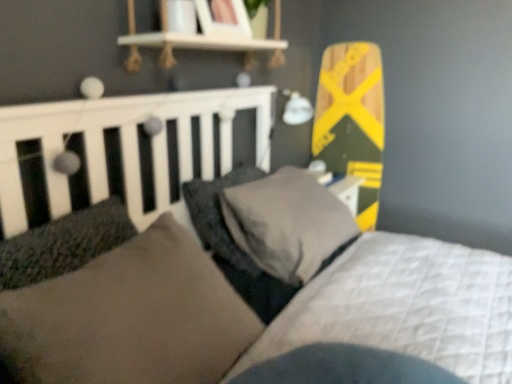
Question: Considering their positions, is suede-like brown pillow at center, which is the first pillow in front-to-back order, located in front of or behind dark gray textured pillow at center, placed as the 3th pillow when sorted from front to back?

Choices:
 (A) front
 (B) behind

Answer: (A)

Question: Visually, is suede-like brown pillow at center, the third pillow from the back, positioned to the left or to the right of dark gray textured pillow at center, placed as the 3th pillow when sorted from front to back?

Choices:
 (A) left
 (B) right

Answer: (A)

Question: Considering the real-world distances, which object is farthest from the suede-like brown pillow at center, the third pillow from the back?

Choices:
 (A) yellow-green wood skateboard at upper right
 (B) dark gray textured pillow at center, placed as the 3th pillow when sorted from front to back
 (C) dark gray plush pillow at center, the second pillow viewed from the back

Answer: (A)

Question: Considering the real-world distances, which object is farthest from the yellow-green wood skateboard at upper right?

Choices:
 (A) dark gray textured pillow at center, the first pillow viewed from the back
 (B) dark gray plush pillow at center, the second pillow positioned from the front
 (C) suede-like brown pillow at center, which is the first pillow in front-to-back order

Answer: (C)